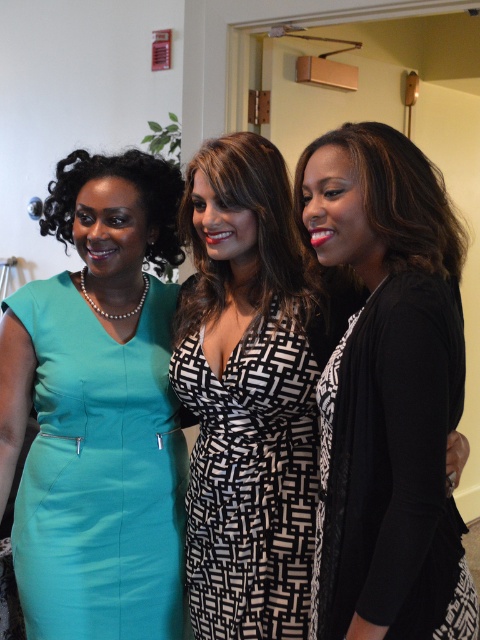
Question: Can you confirm if black matte cardigan at right is positioned to the right of teal matte dress at left?

Choices:
 (A) yes
 (B) no

Answer: (A)

Question: Which point is farther to the camera?

Choices:
 (A) (115, 561)
 (B) (389, 618)

Answer: (A)

Question: Considering the relative positions of black matte cardigan at right and teal matte dress at left in the image provided, where is black matte cardigan at right located with respect to teal matte dress at left?

Choices:
 (A) right
 (B) left

Answer: (A)

Question: Does black matte cardigan at right appear on the right side of black and white woven dress at center?

Choices:
 (A) yes
 (B) no

Answer: (A)

Question: Which object is positioned closest to the black and white woven dress at center?

Choices:
 (A) teal matte dress at left
 (B) black matte cardigan at right

Answer: (A)

Question: Which of the following is the farthest from the observer?

Choices:
 (A) (407, 192)
 (B) (120, 401)

Answer: (B)